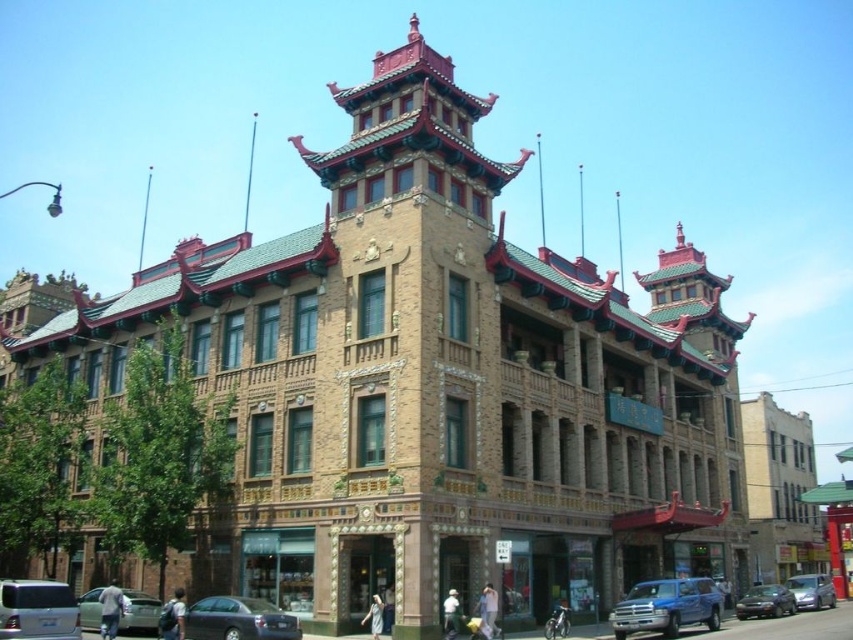
Is brown textured building at center further to camera compared to metallic silver car at lower left?

No, brown textured building at center is in front of metallic silver car at lower left.

Locate an element on the screen. Image resolution: width=853 pixels, height=640 pixels. brown textured building at center is located at coordinates 405,348.

Measure the distance from brown textured building at center to metallic silver sedan at lower right.

The distance of brown textured building at center from metallic silver sedan at lower right is 94.72 feet.

Does brown textured building at center have a lesser width compared to metallic silver sedan at lower right?

No, brown textured building at center is not thinner than metallic silver sedan at lower right.

Which is in front, point (416, 96) or point (766, 600)?

Point (416, 96)

At what (x,y) coordinates should I click in order to perform the action: click on brown textured building at center. Please return your answer as a coordinate pair (x, y). The width and height of the screenshot is (853, 640). Looking at the image, I should click on (405, 348).

Which of these two, silver metallic van at lower left or metallic blue car at lower right, stands shorter?

silver metallic van at lower left

Which of these two, silver metallic van at lower left or metallic blue car at lower right, stands taller?

Standing taller between the two is metallic blue car at lower right.

Which is behind, point (9, 592) or point (815, 579)?

The point (815, 579) is behind.

Where is `silver metallic van at lower left`? silver metallic van at lower left is located at coordinates (38, 611).